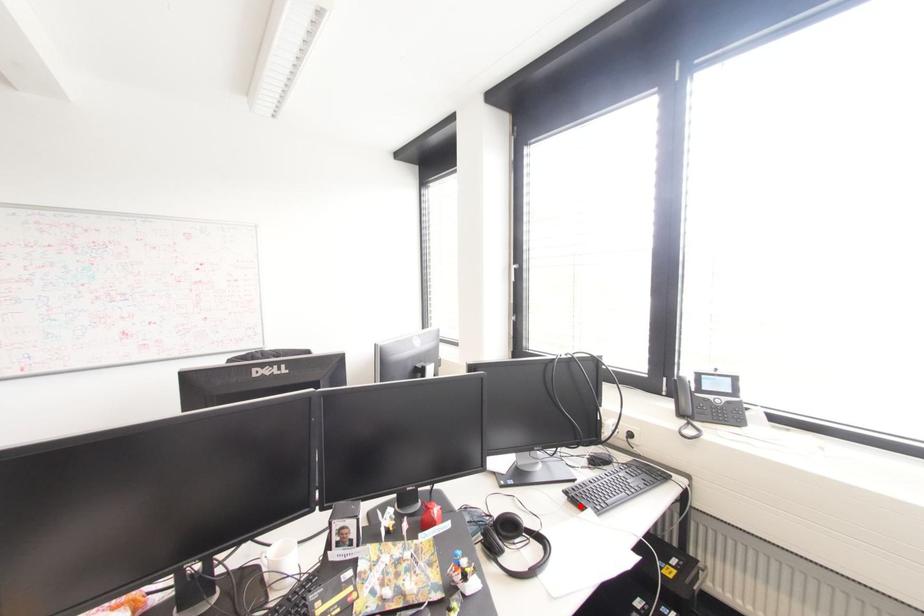
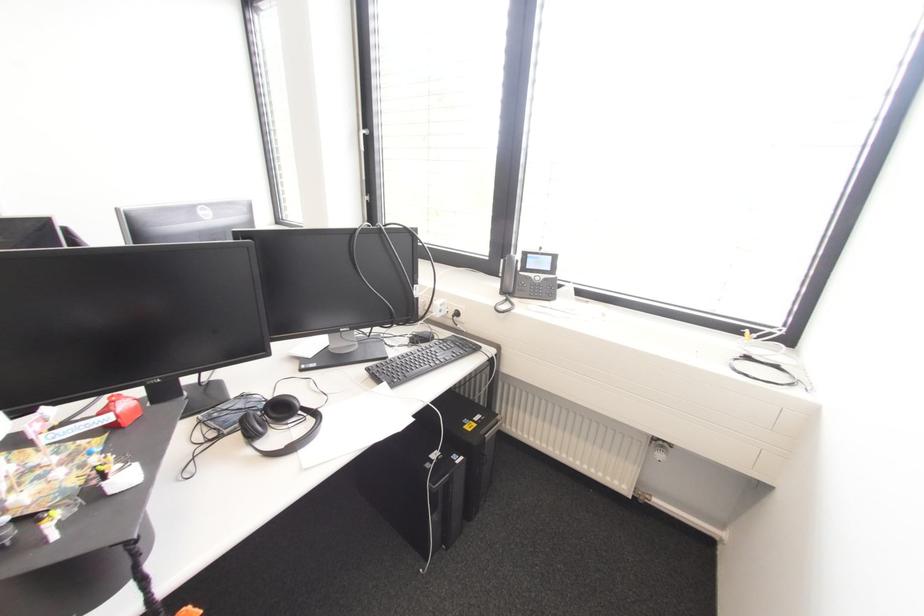
The point at the highlighted location is marked in the first image. Where is the corresponding point in the second image?

(379, 381)